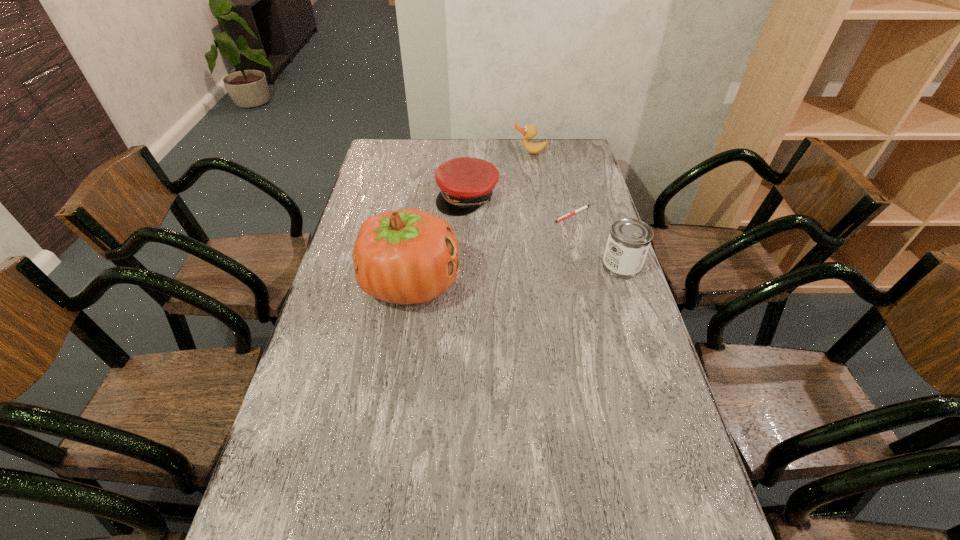
Locate an element on the screen. This screenshot has width=960, height=540. vacant point located between the can and the pumpkin is located at coordinates (516, 274).

The width and height of the screenshot is (960, 540). I want to click on vacant space that is in between the can and the shortest object, so click(x=597, y=240).

Locate an element on the screen. The width and height of the screenshot is (960, 540). free spot between the pumpkin and the farthest object is located at coordinates (470, 218).

Where is `the closest object relative to the can`? This screenshot has width=960, height=540. the closest object relative to the can is located at coordinates (584, 207).

You are a GUI agent. You are given a task and a screenshot of the screen. Output one action in this format:
    pyautogui.click(x=<x>, y=<y>)
    Task: Click on the closest object to the pen
    This screenshot has width=960, height=540.
    Given the screenshot: What is the action you would take?
    pyautogui.click(x=629, y=239)

You are a GUI agent. You are given a task and a screenshot of the screen. Output one action in this format:
    pyautogui.click(x=<x>, y=<y>)
    Task: Click on the free space that satisfies the following two spatial constraints: 1. on the front side of the can; 2. on the left side of the cap
    
    Given the screenshot: What is the action you would take?
    pyautogui.click(x=465, y=266)